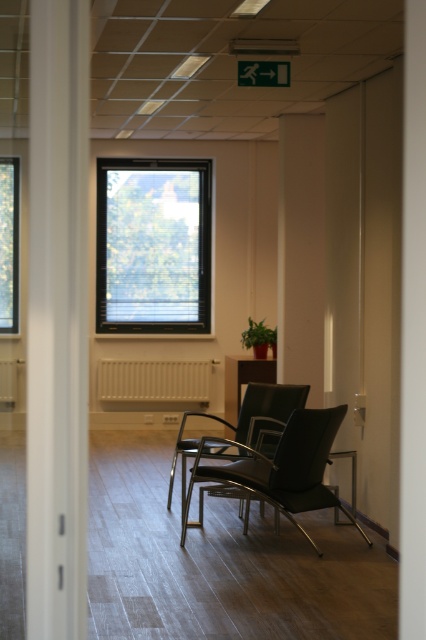
Between black leather armchair at center and matte black chair at center, which one has more height?

black leather armchair at center

Does point (282, 468) come farther from viewer compared to point (230, 362)?

No, it is not.

Where is `black leather armchair at center`? black leather armchair at center is located at coordinates (282, 468).

Can you confirm if matte glass window at center is bigger than beige matte radiator at center?

Indeed, matte glass window at center has a larger size compared to beige matte radiator at center.

Find the location of `matte glass window at center`. matte glass window at center is located at coordinates (152, 244).

Locate an element on the screen. This screenshot has height=640, width=426. matte glass window at center is located at coordinates (152, 244).

Can you confirm if black leather armchair at center is shorter than white matte radiator at center?

No.

Is black leather armchair at center smaller than white matte radiator at center?

No.

This screenshot has width=426, height=640. Describe the element at coordinates (282, 468) in the screenshot. I see `black leather armchair at center` at that location.

Image resolution: width=426 pixels, height=640 pixels. In order to click on black leather armchair at center in this screenshot , I will do `click(282, 468)`.